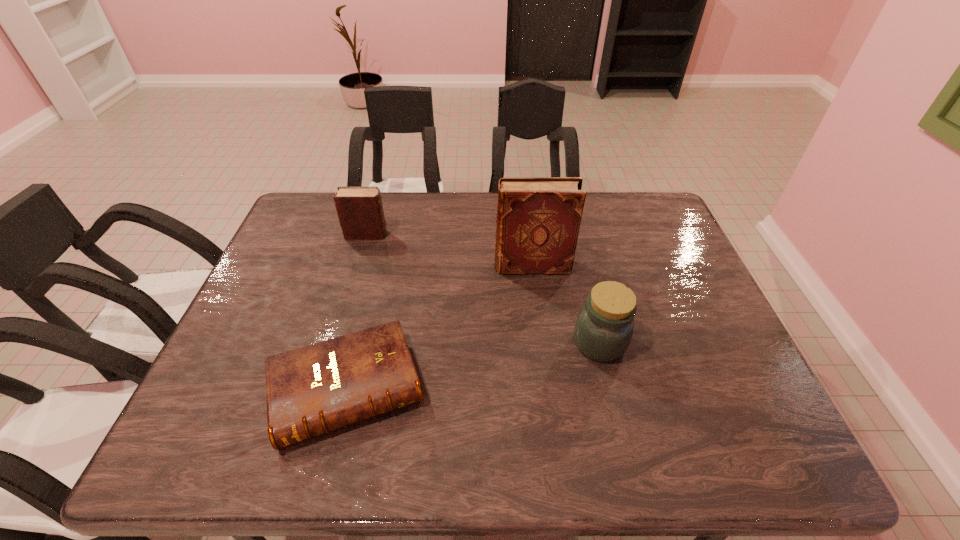
This screenshot has width=960, height=540. Find the location of `vacant position located on the spine side of the farthest object`. vacant position located on the spine side of the farthest object is located at coordinates (439, 234).

Locate an element on the screen. The height and width of the screenshot is (540, 960). free point located on the back of the nearer hardback book is located at coordinates pyautogui.click(x=364, y=320).

The image size is (960, 540). Identify the location of object that is at the far edge. (360, 211).

At what (x,y) coordinates should I click in order to perform the action: click on object at the near edge. Please return your answer as a coordinate pair (x, y). The height and width of the screenshot is (540, 960). Looking at the image, I should click on (311, 390).

The height and width of the screenshot is (540, 960). I want to click on object that is positioned at the left edge, so click(x=311, y=390).

Find the location of a particular element. object present at the near left corner is located at coordinates (311, 390).

Find the location of a particular element. free space at the far edge is located at coordinates (594, 206).

Locate an element on the screen. This screenshot has height=540, width=960. free space at the near edge is located at coordinates (636, 433).

The width and height of the screenshot is (960, 540). In order to click on vacant space at the left edge of the desktop in this screenshot , I will do `click(271, 256)`.

Identify the location of free space at the right edge. The image size is (960, 540). (715, 424).